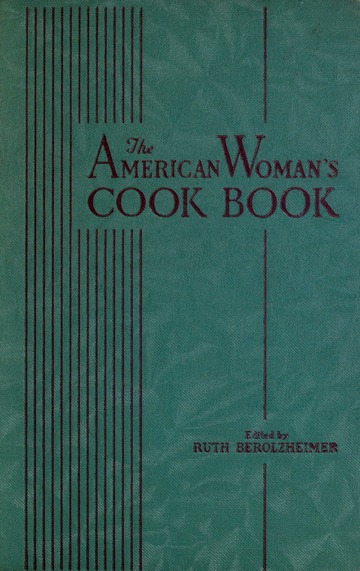
Image resolution: width=360 pixels, height=571 pixels. I want to click on green marble, so click(x=7, y=220), click(x=215, y=261), click(x=313, y=266).